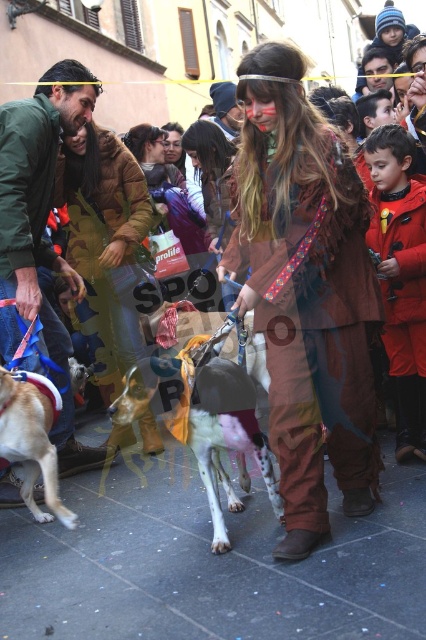
You are a photographer trying to capture the festive atmosphere. You notice a white fur dog at center and a brown leather jacket at center. Which object is positioned to the right of the other?

The white fur dog at center is to the right of the brown leather jacket at center.

You are a photographer trying to capture a photo of the light brown fur at lower left and the brown leather jacket at center. Which object should you focus on first if you want to ensure both are in focus without adjusting your camera settings?

The light brown fur at lower left is shorter than the brown leather jacket at center, so you should focus on the brown leather jacket at center first to ensure both are in focus.

You are a photographer setting up a tripod to capture the festive scene. You have two items to place on the ground for the shot. The camouflage fabric jacket at center and the light brown fur at lower left. To ensure they are within a 12 feet distance for the camera frame, will their current placement work?

The camouflage fabric jacket at center and the light brown fur at lower left are 11.87 feet apart, which is within the 12 feet requirement. Their current placement works for the camera frame.